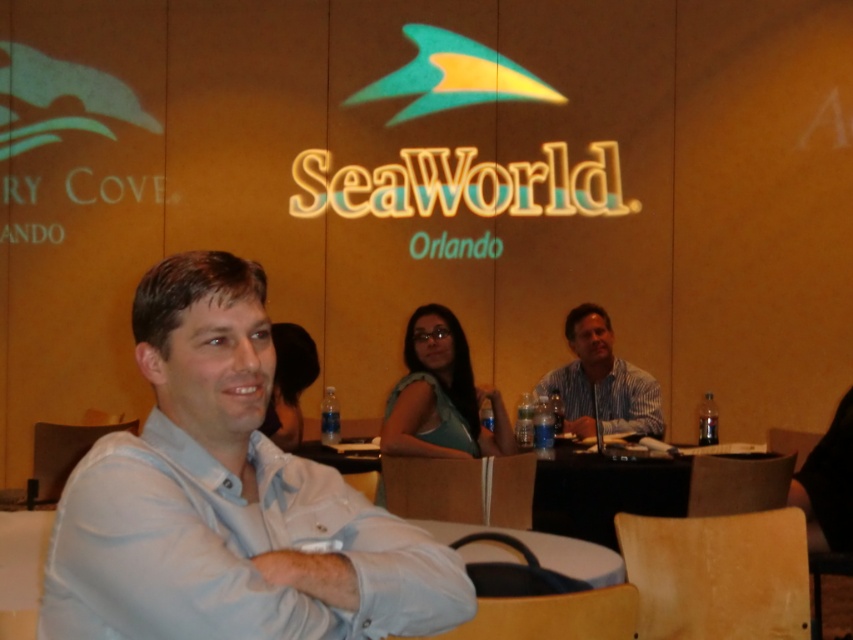
Question: Which of these objects is positioned closest to the white plastic table at center?

Choices:
 (A) light blue shirt at center
 (B) striped cotton shirt at center

Answer: (A)

Question: Among these points, which one is nearest to the camera?

Choices:
 (A) (0, 600)
 (B) (651, 412)

Answer: (A)

Question: Estimate the real-world distances between objects in this image. Which object is farther from the light blue shirt at center?

Choices:
 (A) striped cotton shirt at center
 (B) white plastic table at center

Answer: (A)

Question: Does white plastic table at center have a smaller size compared to striped cotton shirt at center?

Choices:
 (A) yes
 (B) no

Answer: (A)

Question: Does light blue shirt at center come in front of white plastic table at center?

Choices:
 (A) no
 (B) yes

Answer: (B)

Question: From the image, what is the correct spatial relationship of light blue shirt at center in relation to striped cotton shirt at center?

Choices:
 (A) left
 (B) right

Answer: (A)